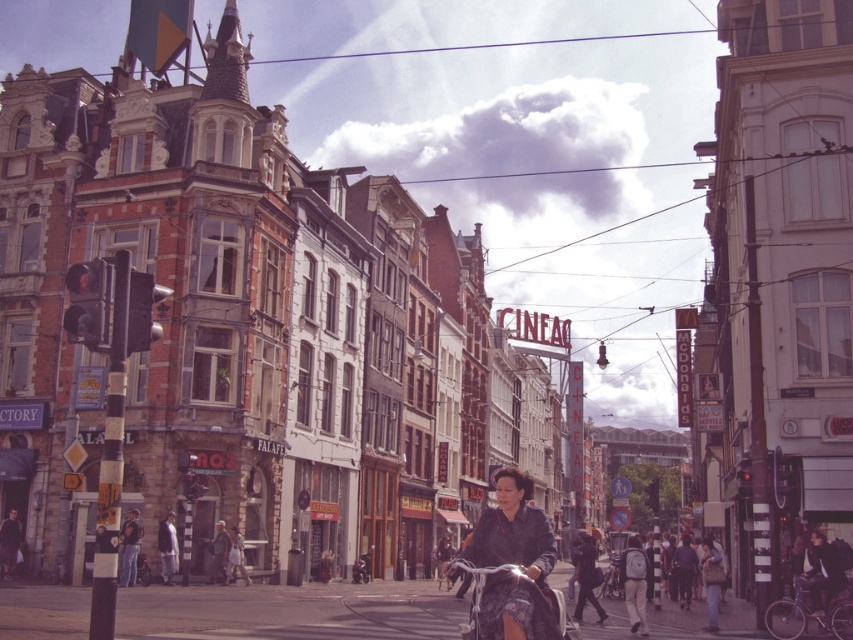
You are a delivery person needing to pass through a narrow alley that is only 1.2 meters wide. You see the shiny metallic bicycle at lower right and dark blue jeans at center in your path. Can you safely navigate through the alley without hitting either object?

The shiny metallic bicycle at lower right might be wider than dark blue jeans at center. Since the alley is only 1.2 meters wide, and the bicycle could be wider than the jeans, there is a risk of collision. It is safer to avoid the alley or find an alternative route to prevent hitting the bicycle.

You are a delivery person needing to pass through the street. You see the dark blue fabric jacket at center and the shiny metallic bicycle at lower right. Which object is taller?

The dark blue fabric jacket at center is taller than the shiny metallic bicycle at lower right according to the description.